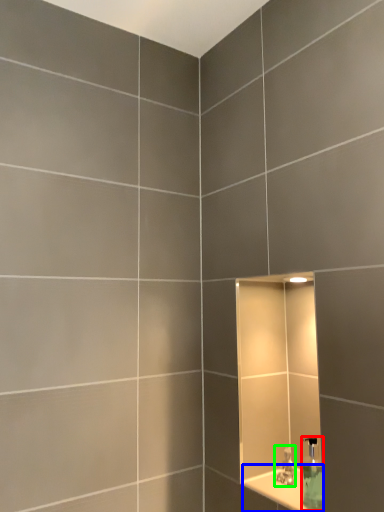
Question: Considering the real-world distances, which object is farthest from soap dispenser (highlighted by a red box)? ledge (highlighted by a blue box) or tap (highlighted by a green box)?

Choices:
 (A) ledge
 (B) tap

Answer: (B)